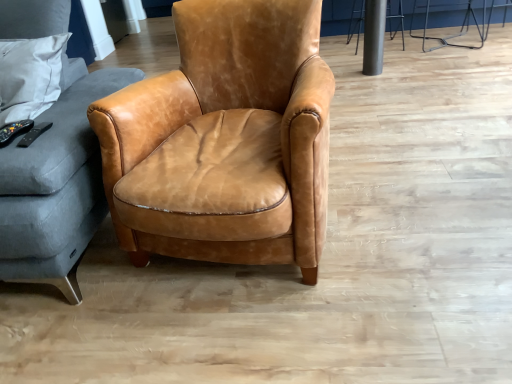
This screenshot has width=512, height=384. Identify the location of free space in front of cognac leather armchair at center. (271, 332).